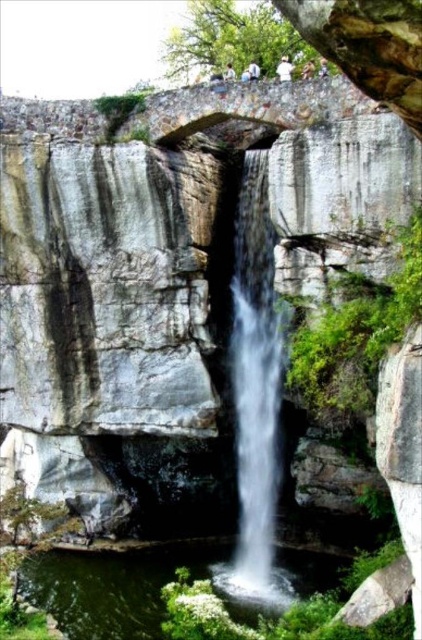
Does white smooth waterfall at center appear on the left side of clear water at center?

Incorrect, white smooth waterfall at center is not on the left side of clear water at center.

Is white smooth waterfall at center above clear water at center?

Indeed, white smooth waterfall at center is positioned over clear water at center.

Where is `white smooth waterfall at center`? white smooth waterfall at center is located at coordinates (256, 388).